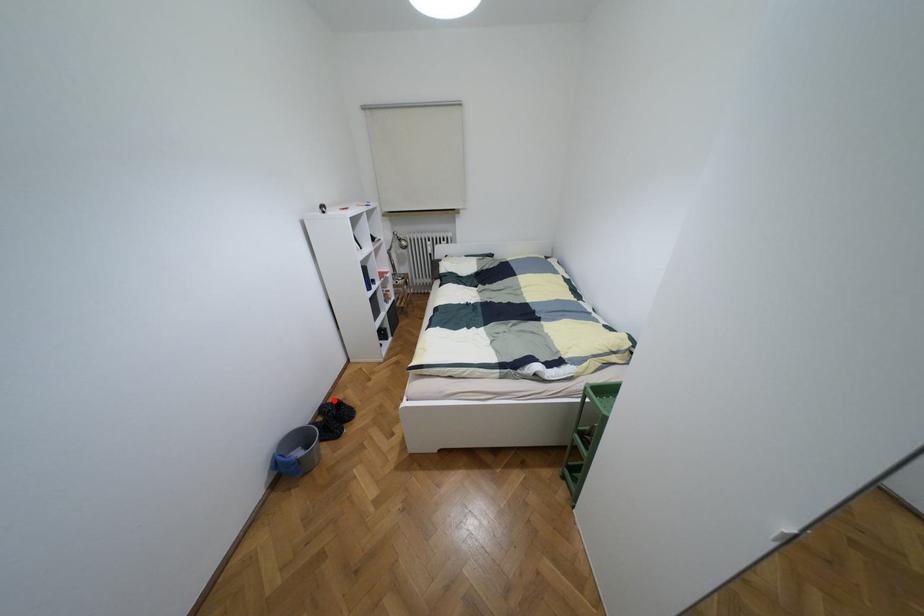
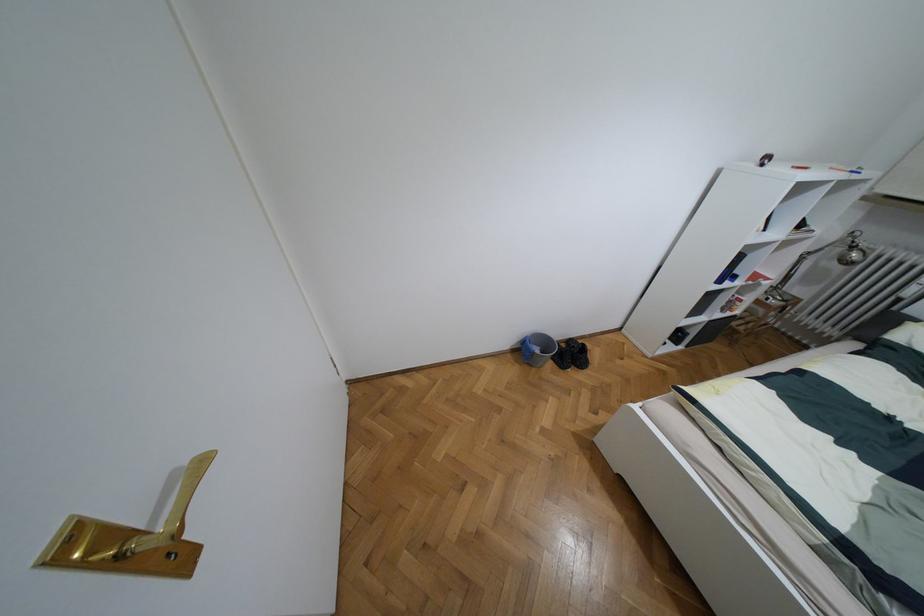
The point at the highlighted location is marked in the first image. Where is the corresponding point in the second image?

(582, 344)